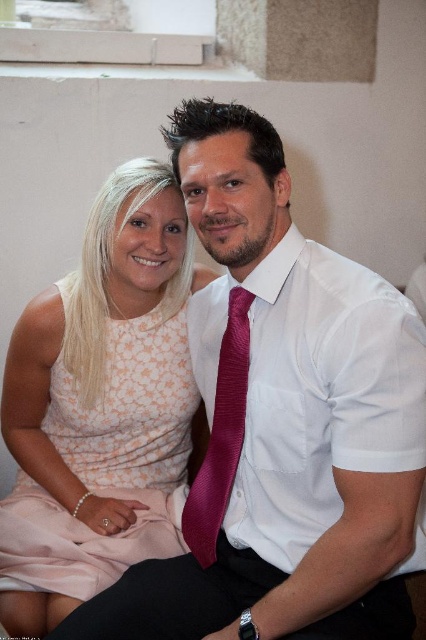
You are a photographer setting up for a group photo. You have to ensure that the pink lace dress at center and the satin burgundy tie at center are both visible in the frame. Given their sizes, which one might require more careful positioning to avoid being obscured?

The pink lace dress at center is much taller as the satin burgundy tie at center, so the dress may require more careful positioning to avoid being obscured by other elements in the frame.

You are a photographer setting up for a group photo. You need to ensure that the pink lace dress at center and the satin burgundy tie at center are both clearly visible in the frame. Based on their positions, which object is wider and might require more space in the composition?

The pink lace dress at center is wider than the satin burgundy tie at center, so it requires more space in the composition.